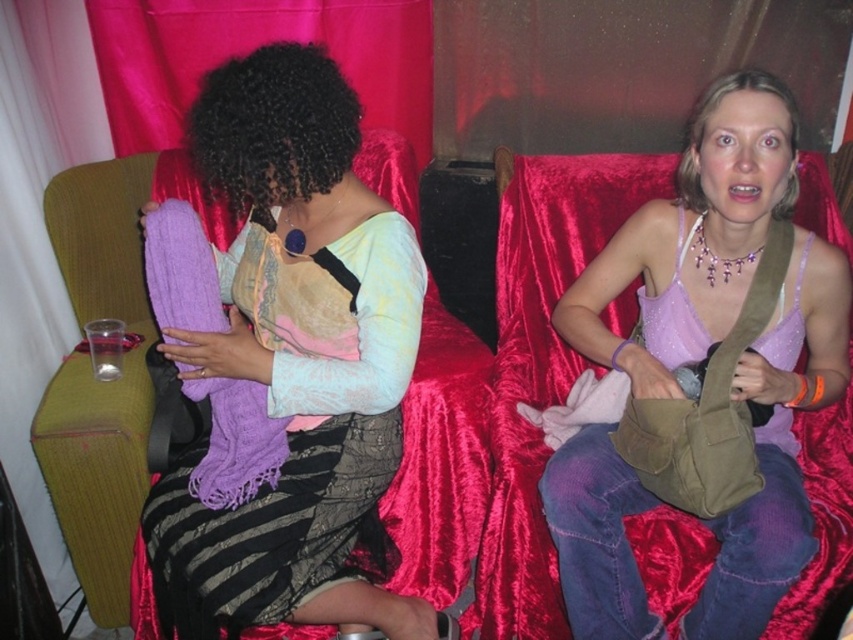
Measure the distance from matte purple scarf at upper right to purple soft scarf at center.

The distance of matte purple scarf at upper right from purple soft scarf at center is 28.79 inches.

Is matte purple scarf at upper right shorter than purple soft scarf at center?

In fact, matte purple scarf at upper right may be taller than purple soft scarf at center.

Image resolution: width=853 pixels, height=640 pixels. What do you see at coordinates (692, 236) in the screenshot? I see `matte purple scarf at upper right` at bounding box center [692, 236].

This screenshot has height=640, width=853. Find the location of `matte purple scarf at upper right`. matte purple scarf at upper right is located at coordinates (692, 236).

Does point (260, 561) come behind point (206, 262)?

No.

Which is above, matte purple scarf at left or purple soft scarf at center?

purple soft scarf at center is higher up.

Where is `matte purple scarf at left`? matte purple scarf at left is located at coordinates (296, 358).

Which of these two, matte purple scarf at left or matte purple scarf at upper right, stands taller?

matte purple scarf at left is taller.

Who is more forward, (329, 419) or (755, 128)?

Point (755, 128) is in front.

Which is behind, point (390, 378) or point (761, 362)?

Point (761, 362)

Identify the location of matte purple scarf at left. (296, 358).